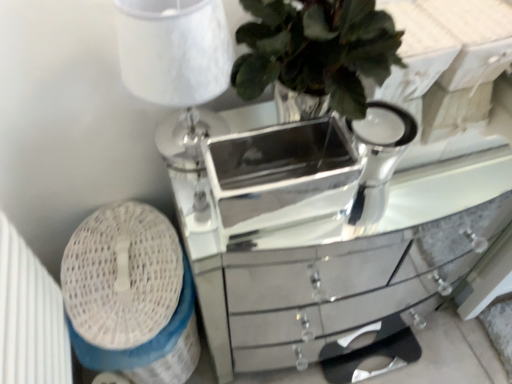
Question: Is white textured lampshade at upper left located within silver/metallic mirrored tray at center?

Choices:
 (A) no
 (B) yes

Answer: (A)

Question: Does silver/metallic mirrored tray at center have a greater height compared to white textured lampshade at upper left?

Choices:
 (A) yes
 (B) no

Answer: (B)

Question: Can you confirm if silver/metallic mirrored tray at center is thinner than white textured lampshade at upper left?

Choices:
 (A) yes
 (B) no

Answer: (A)

Question: From the image's perspective, does silver/metallic mirrored tray at center appear lower than white textured lampshade at upper left?

Choices:
 (A) no
 (B) yes

Answer: (B)

Question: Can you confirm if silver/metallic mirrored tray at center is shorter than white textured lampshade at upper left?

Choices:
 (A) yes
 (B) no

Answer: (A)

Question: In terms of size, does mirrored silver chest of drawers at center appear bigger or smaller than white textured lampshade at upper left?

Choices:
 (A) small
 (B) big

Answer: (B)

Question: Would you say mirrored silver chest of drawers at center is inside or outside white textured lampshade at upper left?

Choices:
 (A) inside
 (B) outside

Answer: (B)

Question: Considering their positions, is mirrored silver chest of drawers at center located in front of or behind white textured lampshade at upper left?

Choices:
 (A) front
 (B) behind

Answer: (B)

Question: From the image's perspective, is mirrored silver chest of drawers at center positioned above or below white textured lampshade at upper left?

Choices:
 (A) below
 (B) above

Answer: (A)

Question: From a real-world perspective, is white textured lampshade at upper left positioned above or below mirrored silver chest of drawers at center?

Choices:
 (A) below
 (B) above

Answer: (B)

Question: Does point click(151, 31) appear closer or farther from the camera than point click(329, 269)?

Choices:
 (A) closer
 (B) farther

Answer: (A)

Question: From the image's perspective, relative to mirrored silver chest of drawers at center, is white textured lampshade at upper left above or below?

Choices:
 (A) above
 (B) below

Answer: (A)

Question: Looking at their shapes, would you say white textured lampshade at upper left is wider or thinner than mirrored silver chest of drawers at center?

Choices:
 (A) thin
 (B) wide

Answer: (A)

Question: In terms of width, does silver/metallic mirrored tray at center look wider or thinner when compared to white textured lampshade at upper left?

Choices:
 (A) wide
 (B) thin

Answer: (B)

Question: Is silver/metallic mirrored tray at center in front of or behind white textured lampshade at upper left in the image?

Choices:
 (A) front
 (B) behind

Answer: (B)